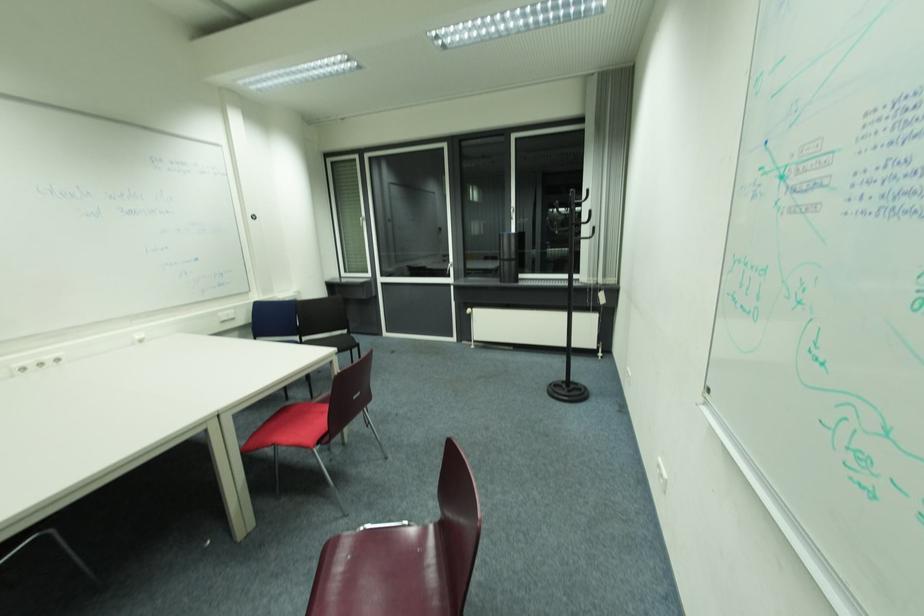
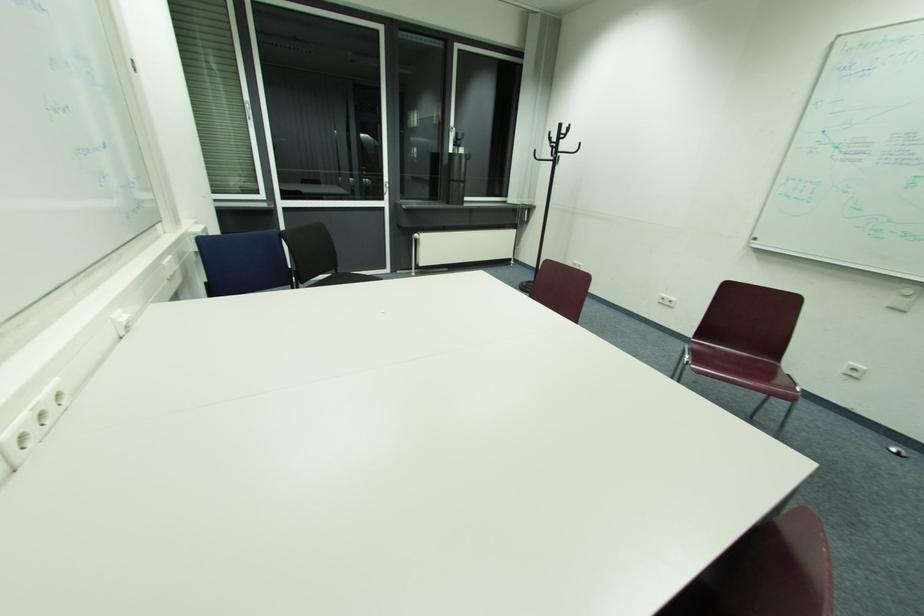
Find the pixel in the second image that matches point 513,261 in the first image.

(464, 182)